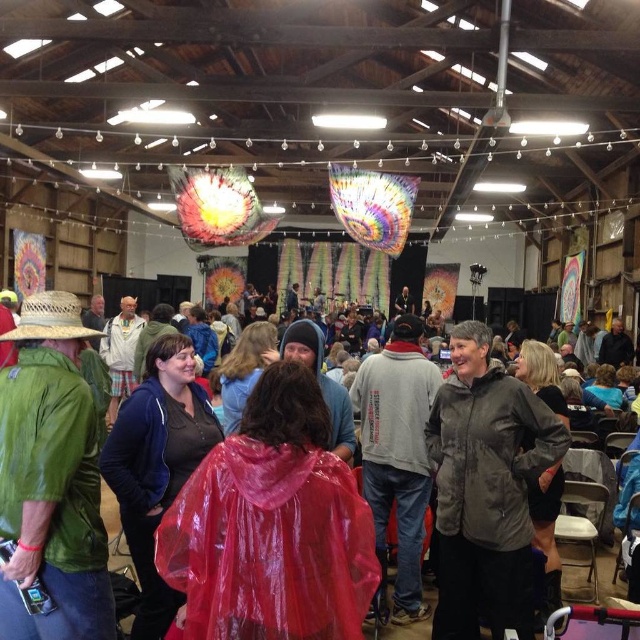
Does transparent plastic poncho at center appear on the left side of strawmaterial/texturehat at left?

No, transparent plastic poncho at center is not to the left of strawmaterial/texturehat at left.

Who is more forward, (24, 456) or (28, 320)?

Point (24, 456) is in front.

Between point (28, 444) and point (74, 336), which one is positioned behind?

Point (74, 336)

Find the location of `transparent plastic poncho at center`. transparent plastic poncho at center is located at coordinates (52, 492).

Does green leather jacket at left have a lesser width compared to strawmaterial/texturehat at left?

Indeed, green leather jacket at left has a lesser width compared to strawmaterial/texturehat at left.

Can you confirm if green leather jacket at left is shorter than strawmaterial/texturehat at left?

No, green leather jacket at left is not shorter than strawmaterial/texturehat at left.

Between point (49, 576) and point (4, 333), which one is positioned behind?

Positioned behind is point (4, 333).

This screenshot has width=640, height=640. I want to click on green leather jacket at left, so click(51, 480).

Which is in front, point (3, 467) or point (109, 589)?

Point (3, 467)

Who is positioned more to the left, green leather jacket at left or transparent plastic poncho at center?

From the viewer's perspective, transparent plastic poncho at center appears more on the left side.

Is point (8, 332) in front of point (1, 620)?

No, (8, 332) is behind (1, 620).

The height and width of the screenshot is (640, 640). I want to click on green leather jacket at left, so click(51, 480).